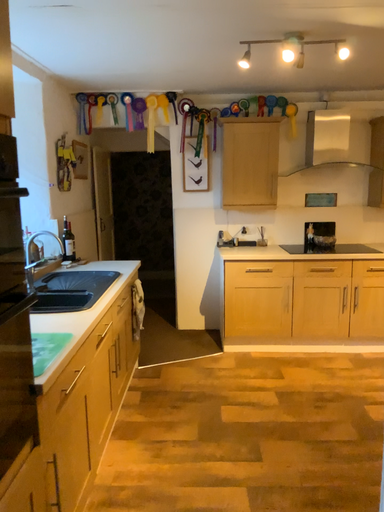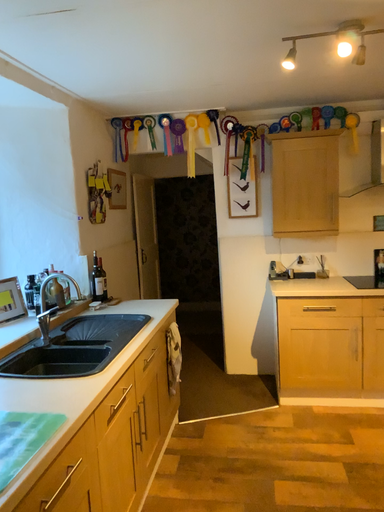
Question: Which way did the camera rotate in the video?

Choices:
 (A) rotated right
 (B) rotated left

Answer: (B)